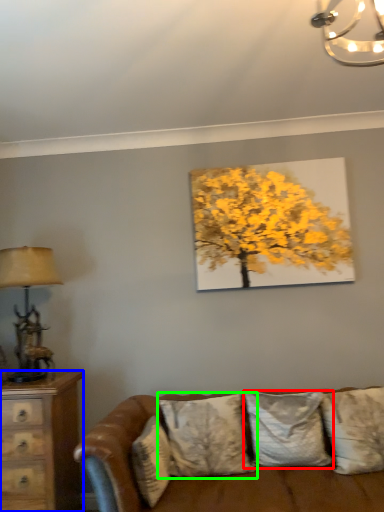
Question: Which object is positioned farthest from pillow (highlighted by a red box)? Select from chest of drawers (highlighted by a blue box) and pillow (highlighted by a green box).

Choices:
 (A) chest of drawers
 (B) pillow

Answer: (A)